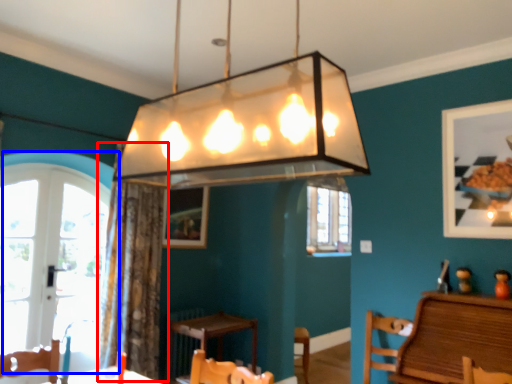
Question: Among these objects, which one is nearest to the camera, curtain (highlighted by a red box) or window (highlighted by a blue box)?

Choices:
 (A) curtain
 (B) window

Answer: (B)